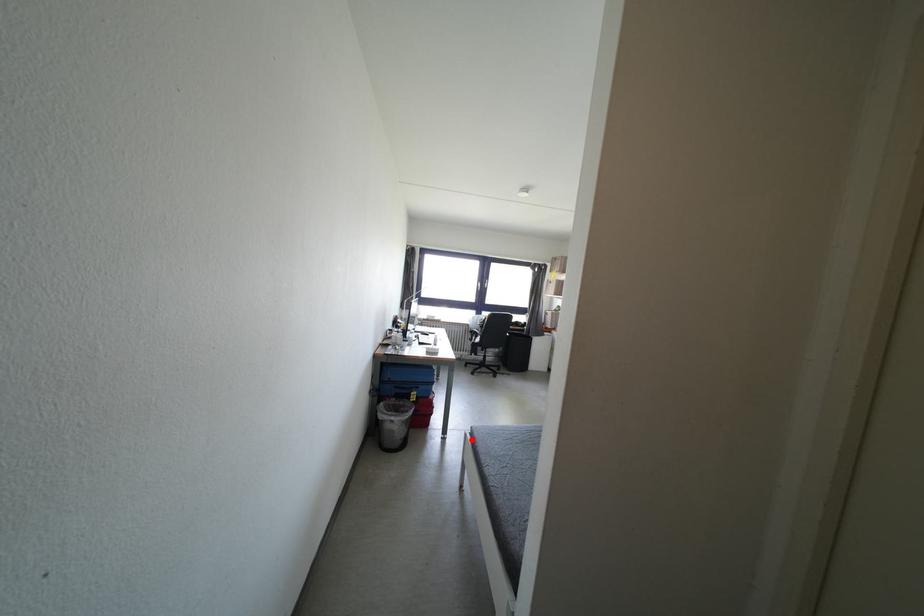
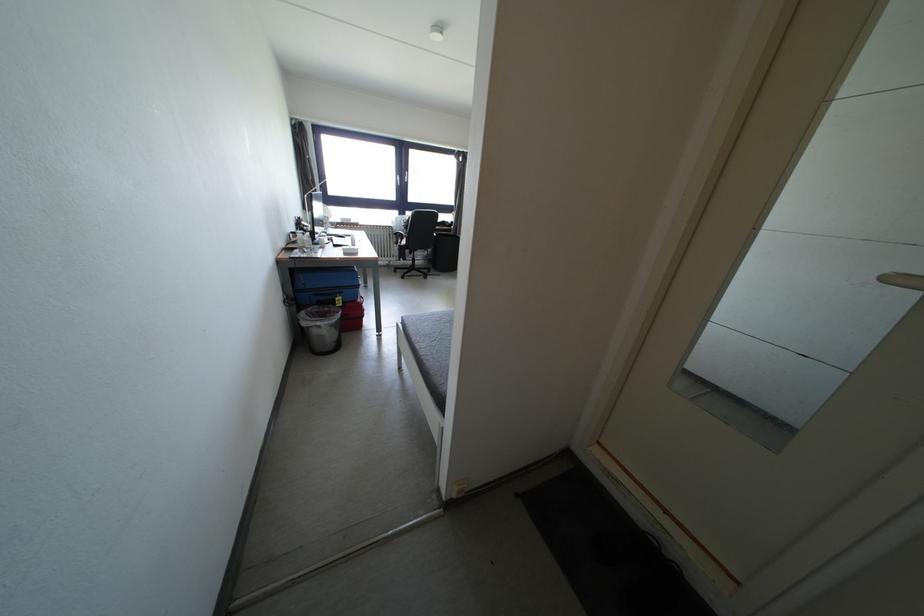
Find the pixel in the second image that matches the highlighted location in the first image.

(403, 330)